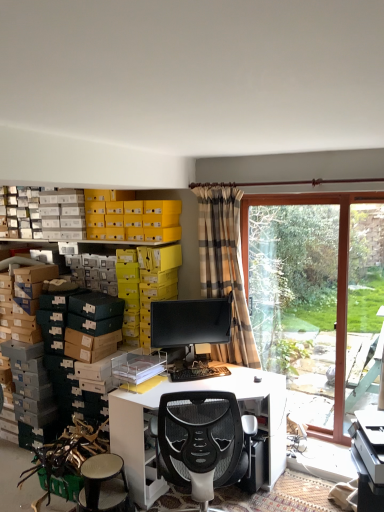
I want to click on free location above plaid fabric curtain at center (from a real-world perspective), so click(223, 184).